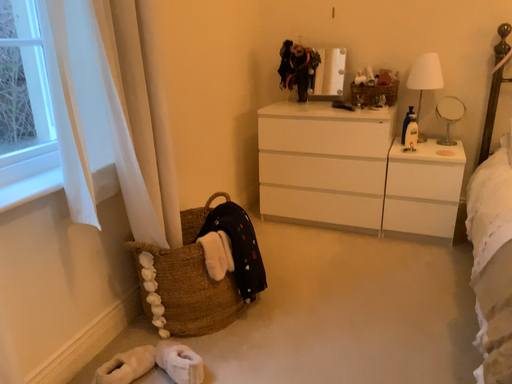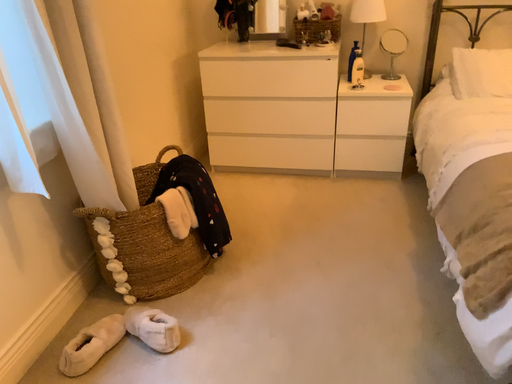
Question: Which way did the camera rotate in the video?

Choices:
 (A) rotated left
 (B) rotated right

Answer: (B)